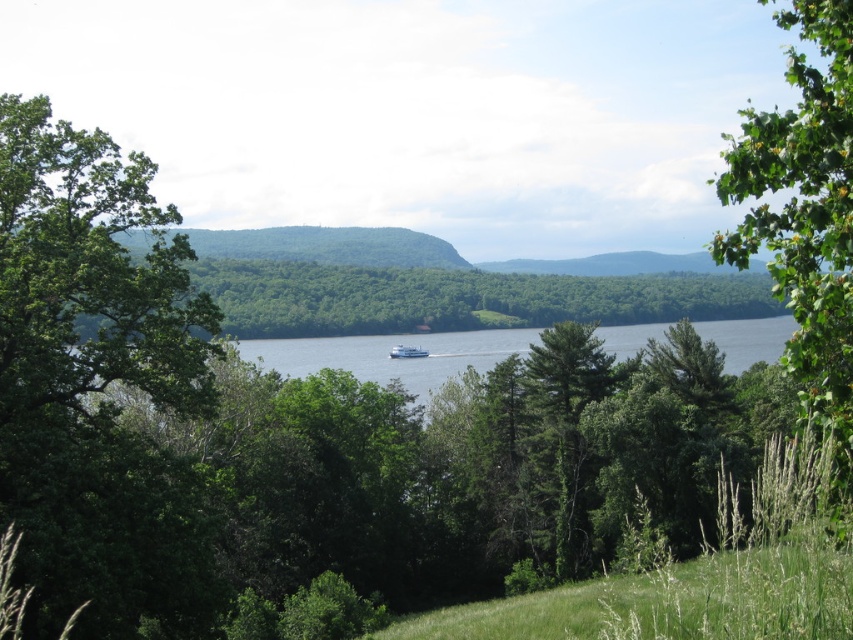
Question: Which of the following is the farthest from the observer?

Choices:
 (A) (412, 355)
 (B) (405, 365)
 (C) (19, 257)
 (D) (837, 260)

Answer: (A)

Question: Which of the following is the closest to the observer?

Choices:
 (A) (271, 344)
 (B) (398, 353)

Answer: (B)

Question: Observing the image, what is the correct spatial positioning of green leafy tree at left in reference to white glossy boat at center?

Choices:
 (A) left
 (B) right

Answer: (A)

Question: Can you confirm if green leafy tree at left is positioned to the right of white glossy boat at center?

Choices:
 (A) no
 (B) yes

Answer: (A)

Question: Which object is farther from the camera taking this photo?

Choices:
 (A) green leafy tree at right
 (B) clear blue water at center
 (C) green leafy tree at left

Answer: (B)

Question: Where is green leafy tree at left located in relation to green leafy tree at right in the image?

Choices:
 (A) above
 (B) below

Answer: (B)